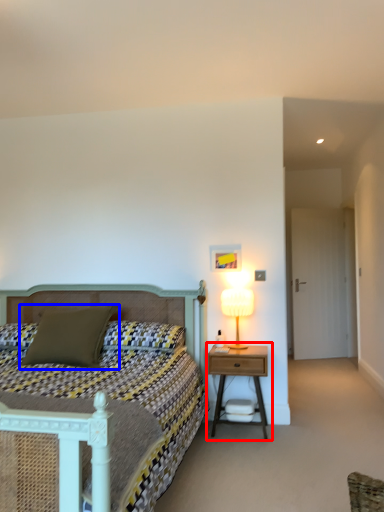
Question: Among these objects, which one is nearest to the camera, nightstand (highlighted by a red box) or pillow (highlighted by a blue box)?

Choices:
 (A) nightstand
 (B) pillow

Answer: (B)